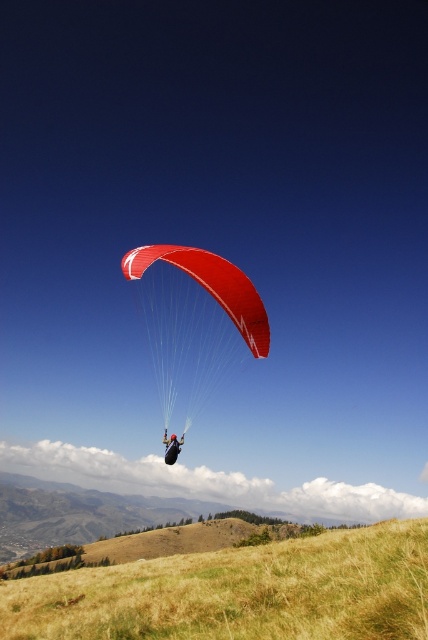
Between point (85, 576) and point (231, 332), which one is positioned behind?

Point (231, 332)

The width and height of the screenshot is (428, 640). In order to click on golden dry grass at lower center in this screenshot , I will do `click(238, 593)`.

Can you confirm if golden dry grass at lower center is bigger than black fabric parachute at center?

Yes.

The image size is (428, 640). Find the location of `golden dry grass at lower center`. golden dry grass at lower center is located at coordinates tap(238, 593).

In order to click on golden dry grass at lower center in this screenshot , I will do `click(238, 593)`.

Does point (246, 305) come closer to viewer compared to point (172, 440)?

That is False.

Who is more distant from viewer, (177, 392) or (172, 436)?

Positioned behind is point (177, 392).

Locate an element on the screen. The width and height of the screenshot is (428, 640). shiny red parachute at center is located at coordinates (193, 323).

Where is `shiny red parachute at center`? The height and width of the screenshot is (640, 428). shiny red parachute at center is located at coordinates (193, 323).